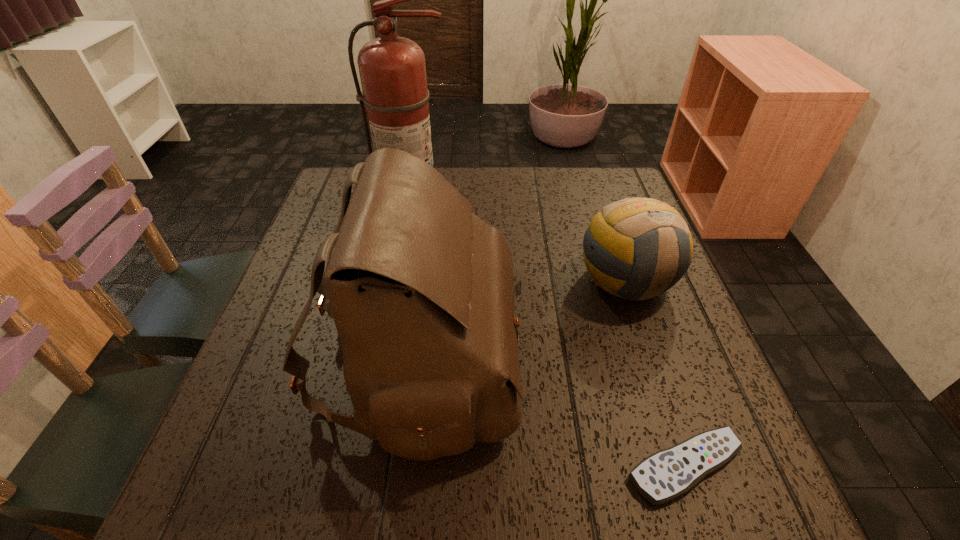
You are a GUI agent. You are given a task and a screenshot of the screen. Output one action in this format:
    pyautogui.click(x=<x>, y=<y>)
    Task: Click on the vacant space that is in between the shortest object and the volleyball
    The image size is (960, 540).
    Given the screenshot: What is the action you would take?
    pyautogui.click(x=655, y=373)

Where is `the closest object to the tallest object`? This screenshot has width=960, height=540. the closest object to the tallest object is located at coordinates (421, 290).

Identify the location of object that is the third nearest to the third shortest object. (392, 69).

This screenshot has width=960, height=540. Identify the location of free location that satisfies the following two spatial constraints: 1. on the front-facing side of the shortest object; 2. on the right side of the tallest object. (365, 466).

I want to click on vacant area that satisfies the following two spatial constraints: 1. on the front flap of the second tallest object; 2. on the left side of the shortest object, so click(405, 466).

The width and height of the screenshot is (960, 540). I want to click on free spot that satisfies the following two spatial constraints: 1. on the front side of the third tallest object; 2. on the front flap of the satchel, so click(x=654, y=362).

Identify the location of free spot that satisfies the following two spatial constraints: 1. on the front flap of the shortest object; 2. on the left side of the satchel. The height and width of the screenshot is (540, 960). (405, 466).

In order to click on blank space that satisfies the following two spatial constraints: 1. on the front flap of the satchel; 2. on the back side of the shortest object in this screenshot , I will do `click(405, 466)`.

Locate an element on the screen. free point that satisfies the following two spatial constraints: 1. on the front flap of the remote control; 2. on the left side of the satchel is located at coordinates (405, 466).

The image size is (960, 540). I want to click on vacant position in the image that satisfies the following two spatial constraints: 1. on the front-facing side of the volleyball; 2. on the left side of the farthest object, so click(399, 281).